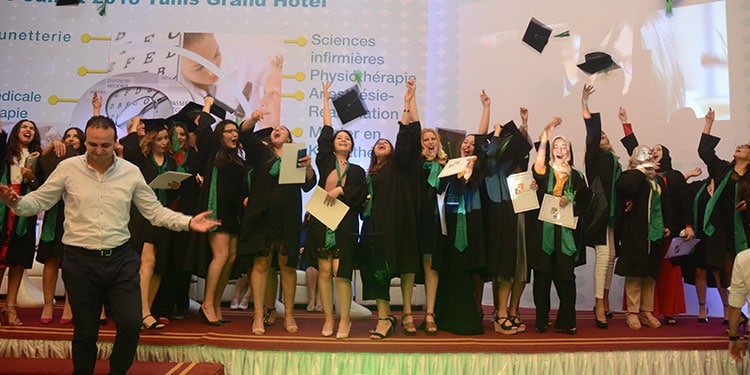
I want to click on stage, so click(x=526, y=340).